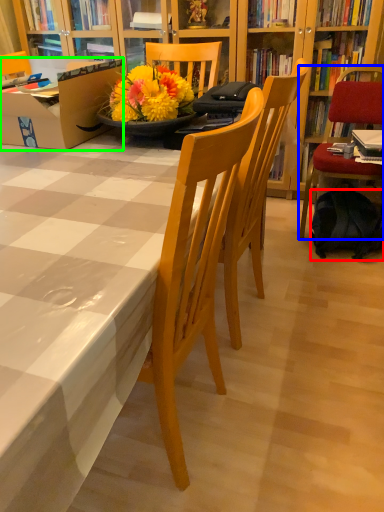
Question: Which object is positioned farthest from backpack (highlighted by a red box)? Select from chair (highlighted by a blue box) and box (highlighted by a green box).

Choices:
 (A) chair
 (B) box

Answer: (B)